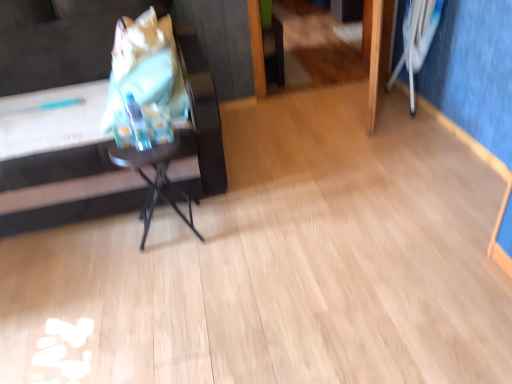
Where is `vacant area to the right of matte black side table at left`? The width and height of the screenshot is (512, 384). vacant area to the right of matte black side table at left is located at coordinates (312, 187).